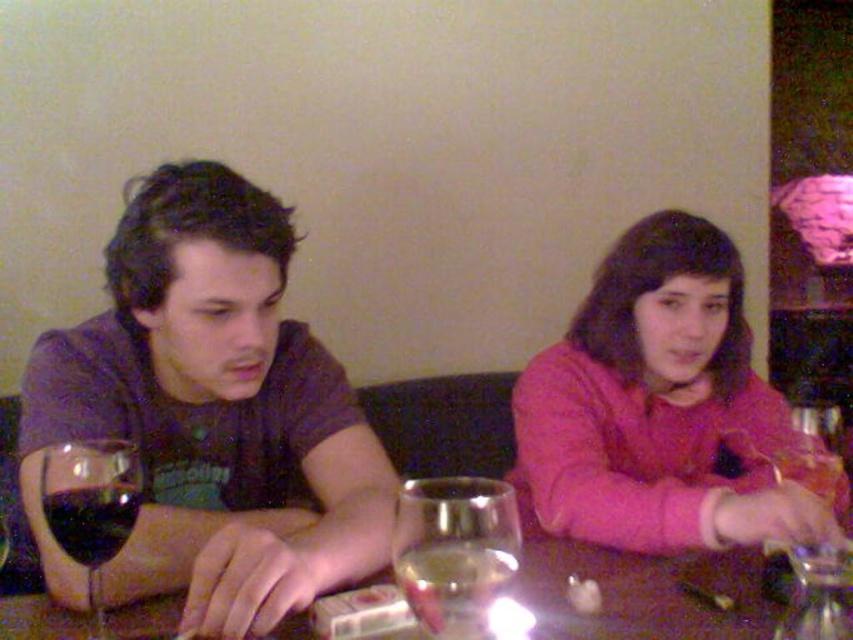
You are a waiter at a restaurant and need to place a small plate between the two points on the table. The points are point (323, 472) and point (97, 520). Based on their positions, which point should the plate be placed closer to ensure it is between them?

The plate should be placed closer to point (97, 520) because point (323, 472) is behind it, making the space between them closer to the front point.

You are a tailor who needs to determine which shirt, the matte black shirt at center or the matte purple shirt at left, requires more fabric for alterations. Based on their sizes, which one would need more fabric?

The matte purple shirt at left requires more fabric for alterations because it is larger than the matte black shirt at center.

You are a photographer taking a picture of the scene. You want to focus on the matte black shirt at center without the translucent glass table at center appearing in the foreground. Is this possible?

The matte black shirt at center is closer to the viewer than the translucent glass table at center, so focusing on the matte black shirt at center would naturally place the translucent glass table at center behind it, making it unlikely to appear in the foreground.